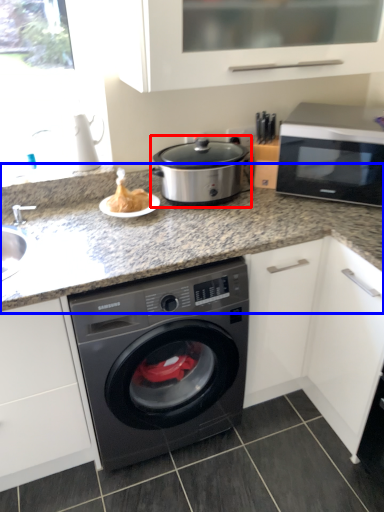
Question: Which object appears closest to the camera in this image, slow cooker (highlighted by a red box) or countertop (highlighted by a blue box)?

Choices:
 (A) slow cooker
 (B) countertop

Answer: (B)